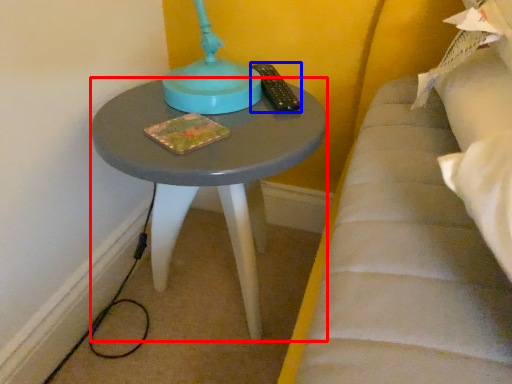
Question: Among these objects, which one is nearest to the camera, table (highlighted by a red box) or remote (highlighted by a blue box)?

Choices:
 (A) table
 (B) remote

Answer: (A)